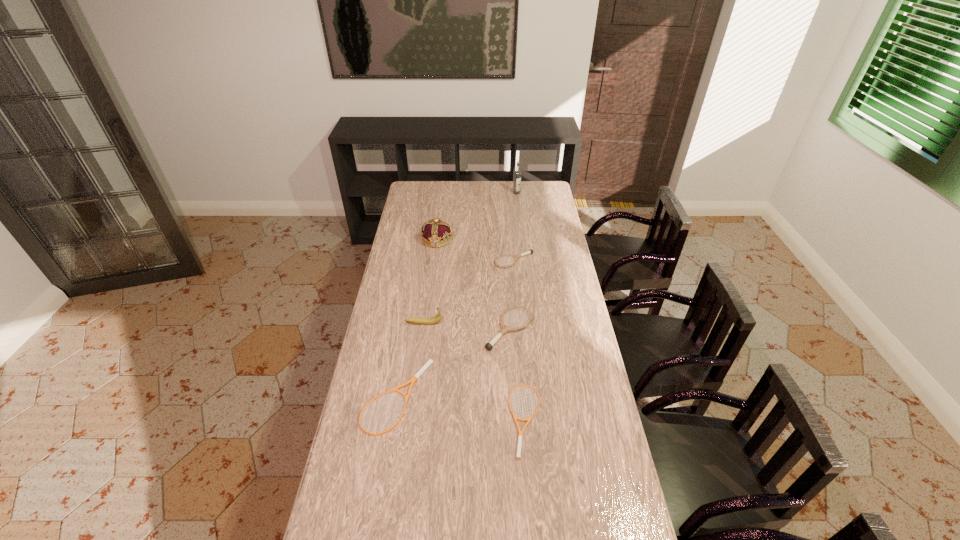
Where is `the left beige tennis racket`? This screenshot has height=540, width=960. the left beige tennis racket is located at coordinates (423, 369).

Image resolution: width=960 pixels, height=540 pixels. What are the coordinates of `the leftmost tennis racket` in the screenshot? It's located at (423, 369).

Locate an element on the screen. The height and width of the screenshot is (540, 960). the right beige tennis racket is located at coordinates (518, 456).

The height and width of the screenshot is (540, 960). In order to click on the shortest object in this screenshot , I will do `click(518, 456)`.

Image resolution: width=960 pixels, height=540 pixels. Identify the location of vacant space located 0.150m on the label of the vodka. (518, 209).

Locate an element on the screen. The width and height of the screenshot is (960, 540). free space located on the front of the purple crown is located at coordinates (430, 295).

You are a GUI agent. You are given a task and a screenshot of the screen. Output one action in this format:
    pyautogui.click(x=<x>, y=<y>)
    Task: Click on the vacant space located 0.320m at the stem of the third tallest object
    The width and height of the screenshot is (960, 540).
    Given the screenshot: What is the action you would take?
    pyautogui.click(x=520, y=323)

The width and height of the screenshot is (960, 540). I want to click on vacant point located on the left of the nearer gray tennis racket, so click(418, 329).

Identify the location of blank space located on the left of the third shortest object. The image size is (960, 540). (446, 260).

Where is `vacant space located on the back of the bigger beige tennis racket`? vacant space located on the back of the bigger beige tennis racket is located at coordinates (406, 328).